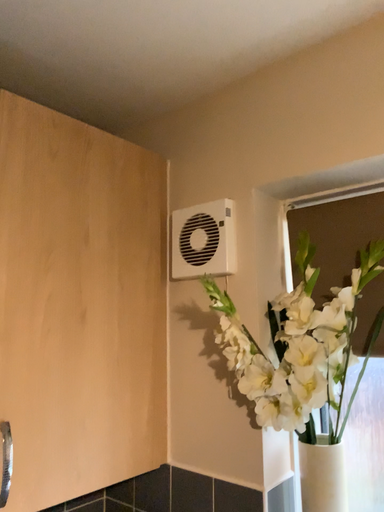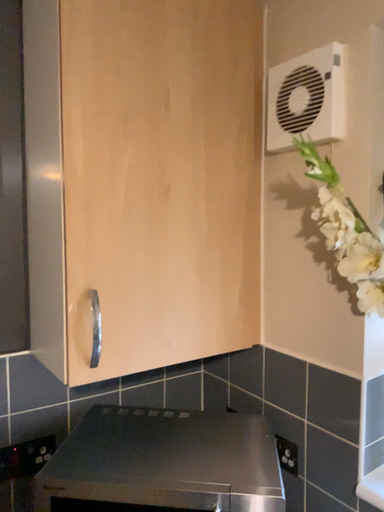
Question: Which way did the camera rotate in the video?

Choices:
 (A) rotated left
 (B) rotated right

Answer: (A)